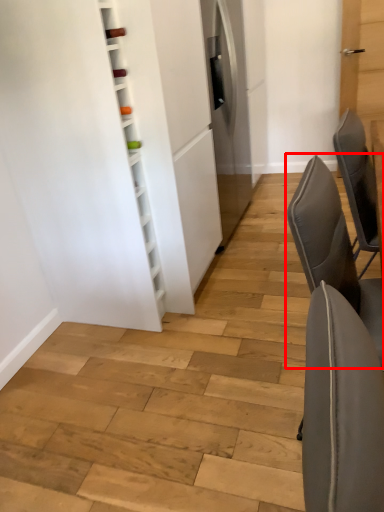
Question: From the image's perspective, where is chair (annotated by the red box) located relative to chair?

Choices:
 (A) above
 (B) below

Answer: (B)